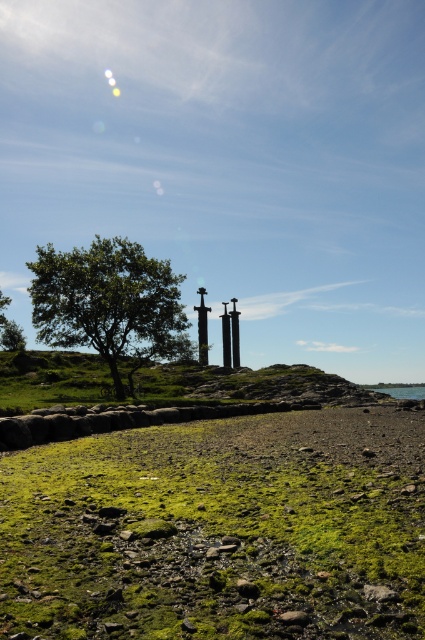
You are a knight standing on the green mossy ground at lower center and see the polished metal sword at center. Which object is nearer to you?

The green mossy ground at lower center is closer to you than the polished metal sword at center.

You are a hiker who wants to place a lightweight tent on the green mossy ground at lower center. According to the coordinates provided, where exactly should you set up the tent?

The green mossy ground at lower center is located at coordinates point (218, 531). You should set up the tent there.

You are a hiker who wants to take a photo of the green leafy tree at center while standing on the green mossy ground at lower center. Can you position yourself so that the tree is to your left side in the photo?

Yes, since the green mossy ground at lower center is positioned on the right side of the green leafy tree at center, you can stand on the green mossy ground at lower center and turn to your left to have the green leafy tree at center appear on your left side in the photo.